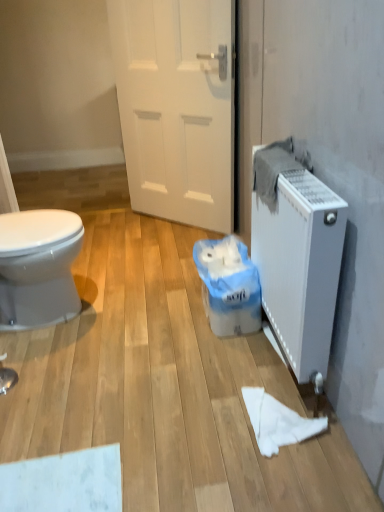
Image resolution: width=384 pixels, height=512 pixels. I want to click on free point behind white paper towel at lower center, so click(250, 367).